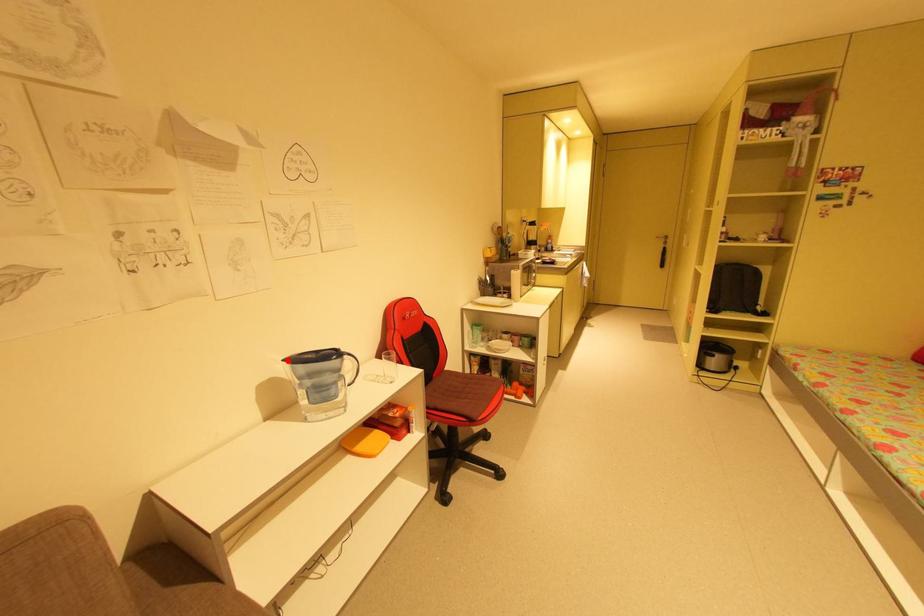
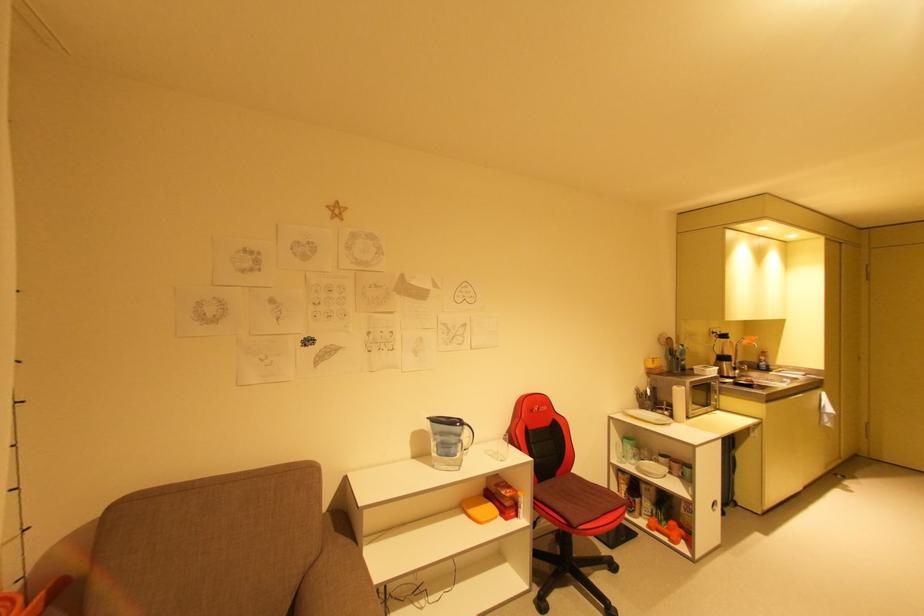
The point at the highlighted location is marked in the first image. Where is the corresponding point in the second image?

(432, 418)